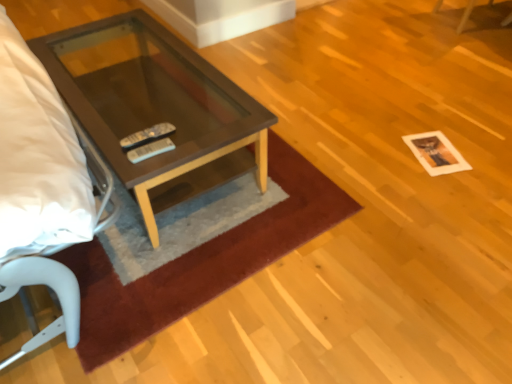
Question: Is matte brown glass coffee table at center behind white paper at lower right?

Choices:
 (A) yes
 (B) no

Answer: (B)

Question: Is matte brown glass coffee table at center closer to camera compared to white paper at lower right?

Choices:
 (A) yes
 (B) no

Answer: (A)

Question: Is matte brown glass coffee table at center with white paper at lower right?

Choices:
 (A) no
 (B) yes

Answer: (A)

Question: Is matte brown glass coffee table at center completely or partially outside of white paper at lower right?

Choices:
 (A) no
 (B) yes

Answer: (B)

Question: Is matte brown glass coffee table at center bigger than white paper at lower right?

Choices:
 (A) no
 (B) yes

Answer: (B)

Question: Is matte brown glass coffee table at center bigger or smaller than white paper at lower right?

Choices:
 (A) small
 (B) big

Answer: (B)

Question: From a real-world perspective, relative to white paper at lower right, is matte brown glass coffee table at center vertically above or below?

Choices:
 (A) above
 (B) below

Answer: (A)

Question: Considering the positions of matte brown glass coffee table at center and white paper at lower right in the image, is matte brown glass coffee table at center wider or thinner than white paper at lower right?

Choices:
 (A) thin
 (B) wide

Answer: (B)

Question: Considering the positions of point (109, 29) and point (435, 167), is point (109, 29) closer or farther from the camera than point (435, 167)?

Choices:
 (A) closer
 (B) farther

Answer: (B)

Question: Considering the positions of point (159, 94) and point (125, 342), is point (159, 94) closer or farther from the camera than point (125, 342)?

Choices:
 (A) closer
 (B) farther

Answer: (B)

Question: Is matte brown glass coffee table at center spatially inside brown plush rug at center, or outside of it?

Choices:
 (A) outside
 (B) inside

Answer: (A)

Question: From the image's perspective, is matte brown glass coffee table at center positioned above or below brown plush rug at center?

Choices:
 (A) above
 (B) below

Answer: (A)

Question: Is matte brown glass coffee table at center in front of or behind brown plush rug at center in the image?

Choices:
 (A) front
 (B) behind

Answer: (B)

Question: Is brown plush rug at center in front of or behind matte brown glass coffee table at center in the image?

Choices:
 (A) front
 (B) behind

Answer: (A)

Question: In the image, is brown plush rug at center on the left side or the right side of matte brown glass coffee table at center?

Choices:
 (A) right
 (B) left

Answer: (A)